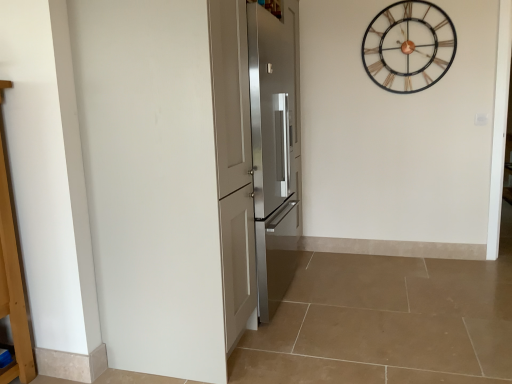
Question: Should I look upward or downward to see metallic wireframe clock at upper right?

Choices:
 (A) up
 (B) down

Answer: (A)

Question: From the image's perspective, is stainless steel refrigerator at center, marked as the 2th door in a front-to-back arrangement, over metallic wireframe clock at upper right?

Choices:
 (A) no
 (B) yes

Answer: (A)

Question: Can you confirm if stainless steel refrigerator at center, the first door in the back-to-front sequence, is smaller than metallic wireframe clock at upper right?

Choices:
 (A) no
 (B) yes

Answer: (A)

Question: Is stainless steel refrigerator at center, the first door in the back-to-front sequence, bigger than metallic wireframe clock at upper right?

Choices:
 (A) yes
 (B) no

Answer: (A)

Question: Can you confirm if stainless steel refrigerator at center, marked as the 2th door in a front-to-back arrangement, is positioned to the right of metallic wireframe clock at upper right?

Choices:
 (A) no
 (B) yes

Answer: (A)

Question: Does stainless steel refrigerator at center, the first door in the back-to-front sequence, lie behind metallic wireframe clock at upper right?

Choices:
 (A) no
 (B) yes

Answer: (A)

Question: Is stainless steel refrigerator at center, marked as the 2th door in a front-to-back arrangement, shorter than metallic wireframe clock at upper right?

Choices:
 (A) no
 (B) yes

Answer: (A)

Question: Is stainless steel refrigerator at center, marked as the 2th door in a front-to-back arrangement, inside metallic wireframe clock at upper right?

Choices:
 (A) no
 (B) yes

Answer: (A)

Question: Can you confirm if metallic wireframe clock at upper right is shorter than stainless steel refrigerator at center, marked as the 2th door in a front-to-back arrangement?

Choices:
 (A) no
 (B) yes

Answer: (B)

Question: Is metallic wireframe clock at upper right positioned in front of stainless steel refrigerator at center, the first door in the back-to-front sequence?

Choices:
 (A) yes
 (B) no

Answer: (B)

Question: Is metallic wireframe clock at upper right taller than stainless steel refrigerator at center, marked as the 2th door in a front-to-back arrangement?

Choices:
 (A) yes
 (B) no

Answer: (B)

Question: Are metallic wireframe clock at upper right and stainless steel refrigerator at center, marked as the 2th door in a front-to-back arrangement, beside each other?

Choices:
 (A) no
 (B) yes

Answer: (A)

Question: Considering the relative sizes of metallic wireframe clock at upper right and stainless steel refrigerator at center, marked as the 2th door in a front-to-back arrangement, in the image provided, is metallic wireframe clock at upper right smaller than stainless steel refrigerator at center, marked as the 2th door in a front-to-back arrangement,?

Choices:
 (A) no
 (B) yes

Answer: (B)

Question: Is satin silver refrigerator at center, the second door in the back-to-front sequence, not within metallic wireframe clock at upper right?

Choices:
 (A) no
 (B) yes

Answer: (B)